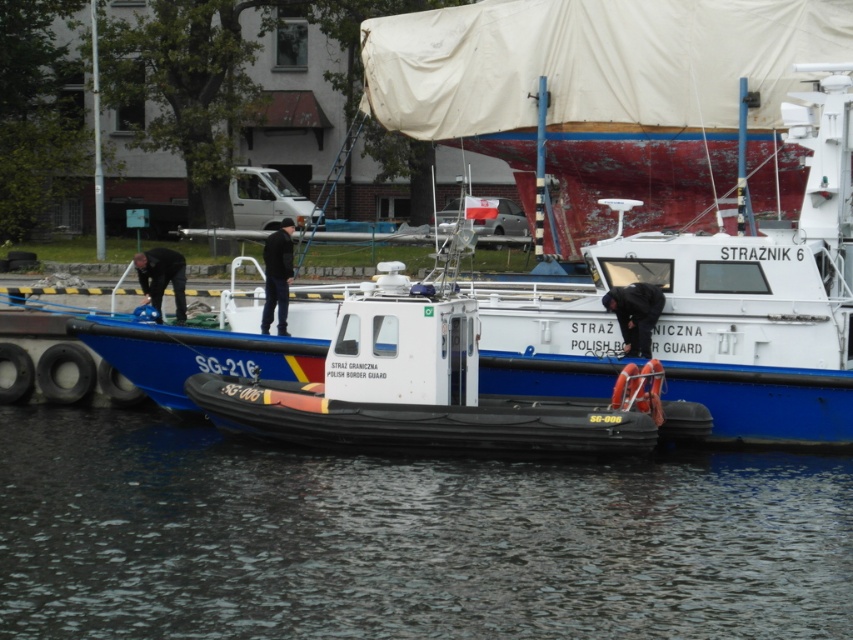
Question: Which point is closer to the camera?

Choices:
 (A) black matte jacket at center
 (B) orange life vest at center

Answer: (B)

Question: Can you confirm if dark gray water at lower center is smaller than matte blue helmet at left?

Choices:
 (A) no
 (B) yes

Answer: (A)

Question: Is white rubber boat at center closer to camera compared to orange life vest at center?

Choices:
 (A) yes
 (B) no

Answer: (A)

Question: Estimate the real-world distances between objects in this image. Which object is closer to the black matte jacket at center?

Choices:
 (A) matte blue helmet at left
 (B) orange life vest at center
 (C) dark gray water at lower center
 (D) white rubber boat at center

Answer: (D)

Question: Which point appears closest to the camera in this image?

Choices:
 (A) (267, 288)
 (B) (387, 262)
 (C) (814, 460)
 (D) (654, 289)

Answer: (B)

Question: Is dark gray water at lower center bigger than orange life vest at center?

Choices:
 (A) yes
 (B) no

Answer: (A)